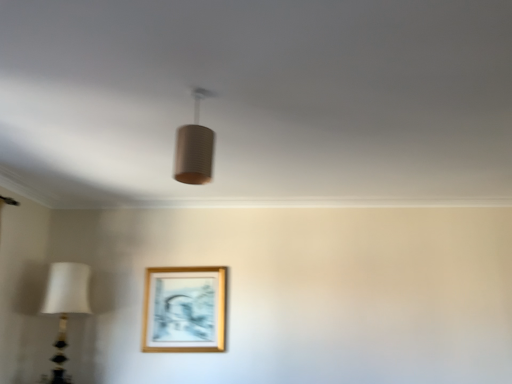
Question: Is gold wooden picture frame at lower center oriented towards matte brown cylinder at center, the second lamp when ordered from left to right?

Choices:
 (A) yes
 (B) no

Answer: (A)

Question: From the image's perspective, does gold wooden picture frame at lower center appear lower than matte brown cylinder at center, which is counted as the 1th lamp, starting from the right?

Choices:
 (A) no
 (B) yes

Answer: (B)

Question: Considering the relative sizes of gold wooden picture frame at lower center and matte brown cylinder at center, arranged as the first lamp when viewed from the front, in the image provided, is gold wooden picture frame at lower center shorter than matte brown cylinder at center, arranged as the first lamp when viewed from the front,?

Choices:
 (A) no
 (B) yes

Answer: (A)

Question: Is gold wooden picture frame at lower center thinner than matte brown cylinder at center, acting as the 2th lamp starting from the bottom?

Choices:
 (A) no
 (B) yes

Answer: (B)

Question: Does gold wooden picture frame at lower center appear on the right side of matte brown cylinder at center, which appears as the second lamp when viewed from the back?

Choices:
 (A) no
 (B) yes

Answer: (A)

Question: Is matte brown cylinder at center, arranged as the first lamp when viewed from the front, inside the boundaries of white fabric lampshade at left, positioned as the first lamp in bottom-to-top order, or outside?

Choices:
 (A) inside
 (B) outside

Answer: (B)

Question: From the image's perspective, relative to white fabric lampshade at left, the second lamp viewed from the top, is matte brown cylinder at center, arranged as the first lamp when viewed from the front, above or below?

Choices:
 (A) above
 (B) below

Answer: (A)

Question: Considering the relative positions of matte brown cylinder at center, arranged as the first lamp when viewed from the front, and white fabric lampshade at left, which is the 1th lamp in left-to-right order, in the image provided, is matte brown cylinder at center, arranged as the first lamp when viewed from the front, to the left or to the right of white fabric lampshade at left, which is the 1th lamp in left-to-right order,?

Choices:
 (A) right
 (B) left

Answer: (A)

Question: In terms of height, does matte brown cylinder at center, acting as the 2th lamp starting from the bottom, look taller or shorter compared to white fabric lampshade at left, placed as the 2th lamp when sorted from right to left?

Choices:
 (A) tall
 (B) short

Answer: (B)

Question: Considering the positions of gold wooden picture frame at lower center and white fabric lampshade at left, the first lamp from the back, in the image, is gold wooden picture frame at lower center taller or shorter than white fabric lampshade at left, the first lamp from the back,?

Choices:
 (A) short
 (B) tall

Answer: (A)

Question: Do you think gold wooden picture frame at lower center is within white fabric lampshade at left, positioned as the first lamp in bottom-to-top order, or outside of it?

Choices:
 (A) outside
 (B) inside

Answer: (A)

Question: From the image's perspective, relative to white fabric lampshade at left, arranged as the 2th lamp when viewed from the front, is gold wooden picture frame at lower center above or below?

Choices:
 (A) above
 (B) below

Answer: (A)

Question: Considering the positions of gold wooden picture frame at lower center and white fabric lampshade at left, which is the 1th lamp in left-to-right order, in the image, is gold wooden picture frame at lower center wider or thinner than white fabric lampshade at left, which is the 1th lamp in left-to-right order,?

Choices:
 (A) wide
 (B) thin

Answer: (B)

Question: From the image's perspective, is white fabric lampshade at left, the second lamp viewed from the top, above or below gold wooden picture frame at lower center?

Choices:
 (A) below
 (B) above

Answer: (A)

Question: Visually, is white fabric lampshade at left, the second lamp viewed from the top, positioned to the left or to the right of gold wooden picture frame at lower center?

Choices:
 (A) right
 (B) left

Answer: (B)